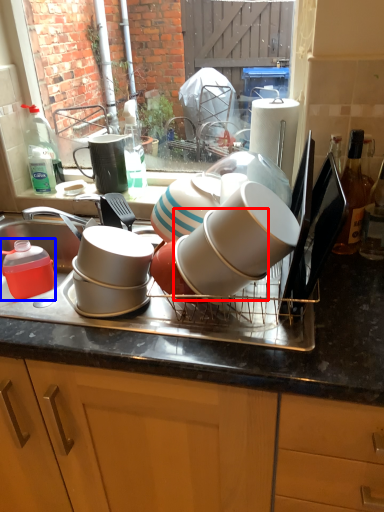
Question: Among these objects, which one is nearest to the camera, tableware (highlighted by a red box) or tableware (highlighted by a blue box)?

Choices:
 (A) tableware
 (B) tableware

Answer: (A)